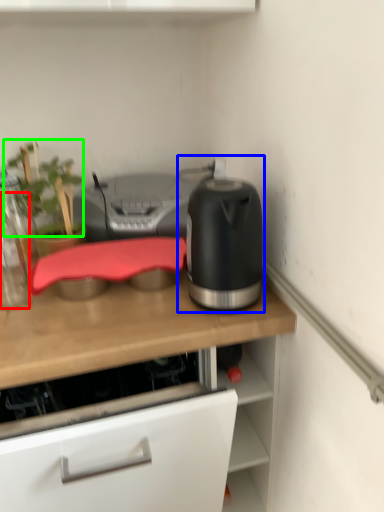
Question: Which object is positioned farthest from bottle (highlighted by a red box)? Select from kitchen appliance (highlighted by a blue box) and plant (highlighted by a green box).

Choices:
 (A) kitchen appliance
 (B) plant

Answer: (A)